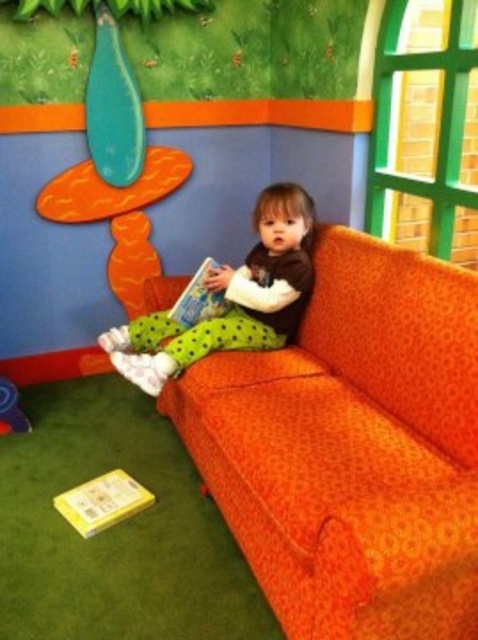
Which is above, orange fabric couch at center or hardcover book at center?

hardcover book at center is higher up.

Which is behind, point (427, 280) or point (203, 316)?

The point (203, 316) is more distant.

Does point (413, 461) come in front of point (195, 317)?

Yes.

Locate an element on the screen. Image resolution: width=478 pixels, height=640 pixels. orange fabric couch at center is located at coordinates (351, 449).

Looking at this image, is yellow matte book at lower left bigger than hardcover book at center?

Actually, yellow matte book at lower left might be smaller than hardcover book at center.

Is point (108, 520) positioned behind point (196, 276)?

That is False.

The width and height of the screenshot is (478, 640). Describe the element at coordinates (101, 500) in the screenshot. I see `yellow matte book at lower left` at that location.

Locate an element on the screen. yellow matte book at lower left is located at coordinates (101, 500).

Does matte green pants at center appear over yellow matte book at lower left?

Indeed, matte green pants at center is positioned over yellow matte book at lower left.

The image size is (478, 640). I want to click on matte green pants at center, so click(231, 298).

The height and width of the screenshot is (640, 478). Find the location of `matte green pants at center`. matte green pants at center is located at coordinates (231, 298).